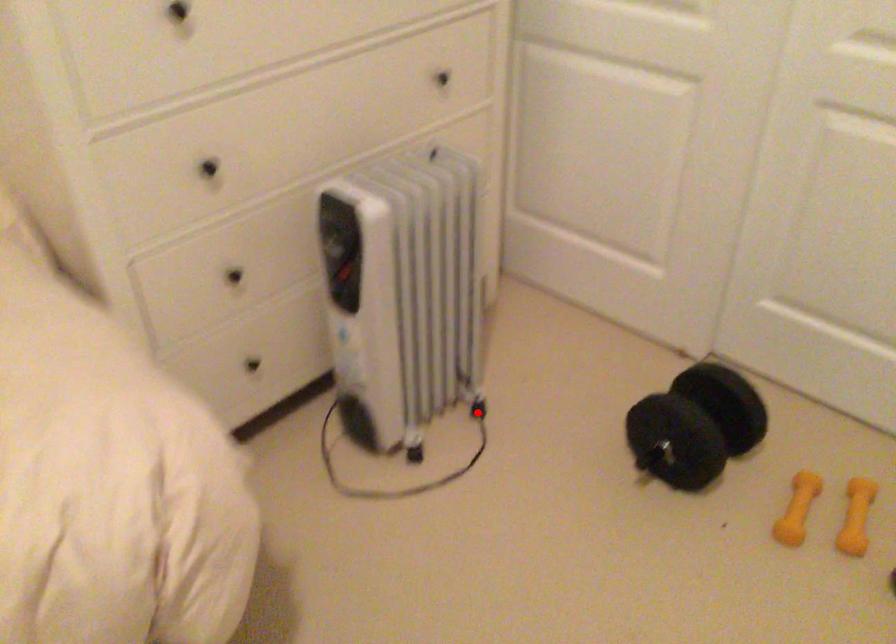
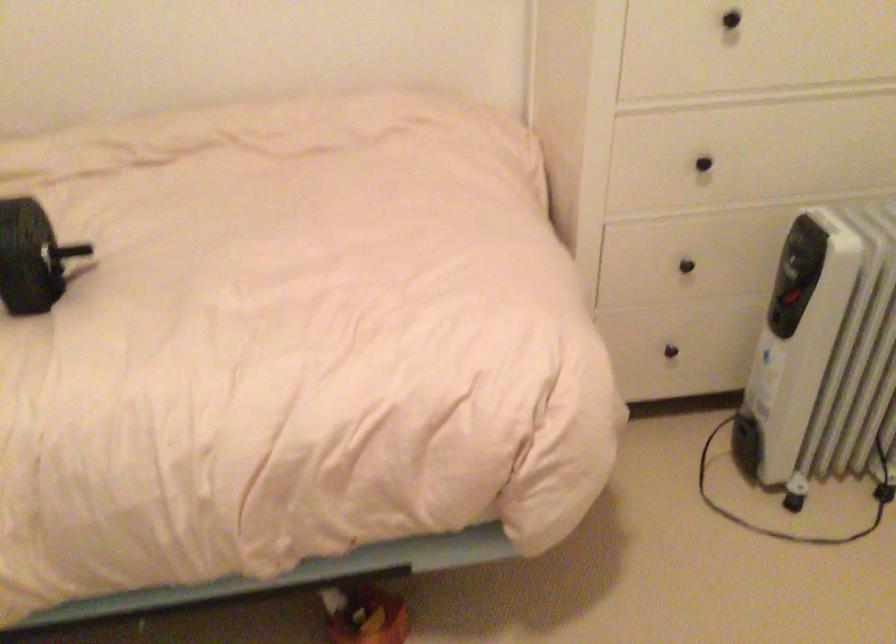
Question: I am providing you with two images of the same scene from different viewpoints. Given a red point in image1, look at the same physical point in image2. Is it:

Choices:
 (A) Closer to the viewpoint
 (B) Farther from the viewpoint

Answer: (A)